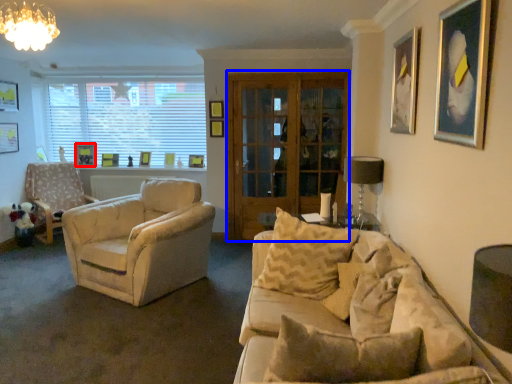
Question: Which object appears closest to the camera in this image, picture frame (highlighted by a red box) or glass door (highlighted by a blue box)?

Choices:
 (A) picture frame
 (B) glass door

Answer: (B)